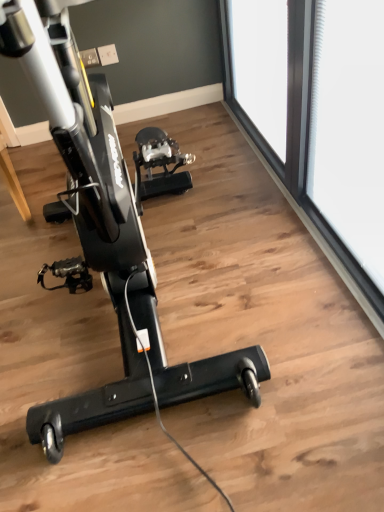
Where is `free point below black matte stationary bicycle at center (from a real-world perspective)`? The height and width of the screenshot is (512, 384). free point below black matte stationary bicycle at center (from a real-world perspective) is located at coordinates (162, 352).